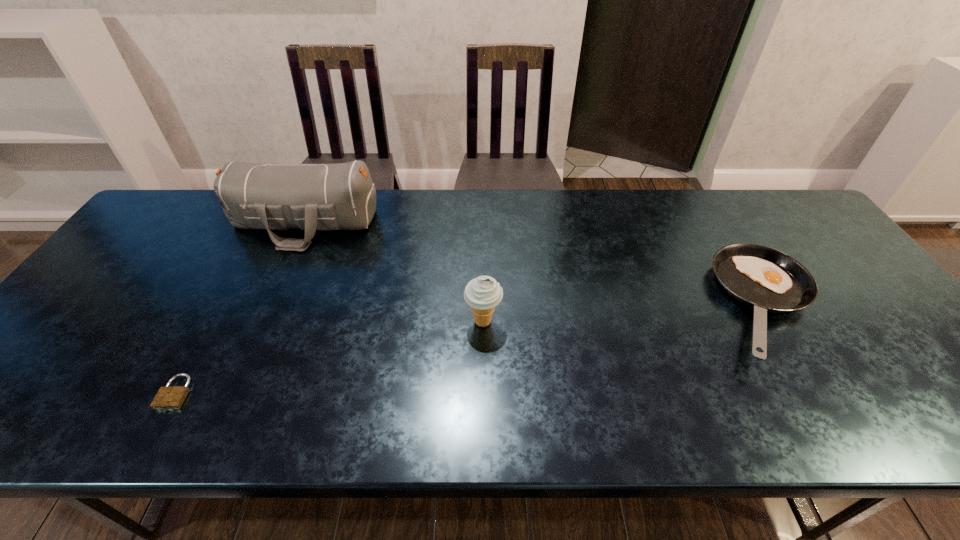
Find the location of `object that is at the far edge`. object that is at the far edge is located at coordinates (324, 197).

What are the coordinates of `object that is at the near edge` in the screenshot? It's located at (169, 397).

This screenshot has width=960, height=540. In order to click on object that is positioned at the right edge in this screenshot , I will do `click(767, 280)`.

The width and height of the screenshot is (960, 540). I want to click on vacant space at the far edge of the desktop, so click(x=690, y=195).

I want to click on vacant space at the near edge of the desktop, so click(x=845, y=422).

In order to click on vacant position at the right edge of the desktop in this screenshot , I will do `click(824, 273)`.

Identify the location of vacant space at the far left corner of the desktop. The width and height of the screenshot is (960, 540). (178, 210).

Where is `vacant area at the far right corner of the desktop`? This screenshot has height=540, width=960. vacant area at the far right corner of the desktop is located at coordinates (775, 202).

This screenshot has width=960, height=540. I want to click on free space between the duffel bag and the frying pan, so click(x=536, y=264).

Where is `vacant space in between the frying pan and the padlock`? Image resolution: width=960 pixels, height=540 pixels. vacant space in between the frying pan and the padlock is located at coordinates (471, 349).